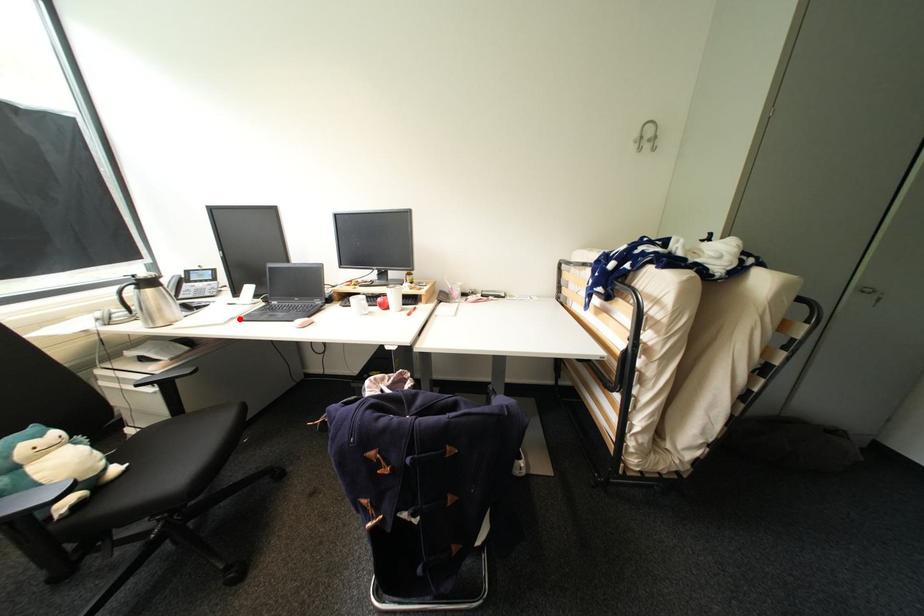
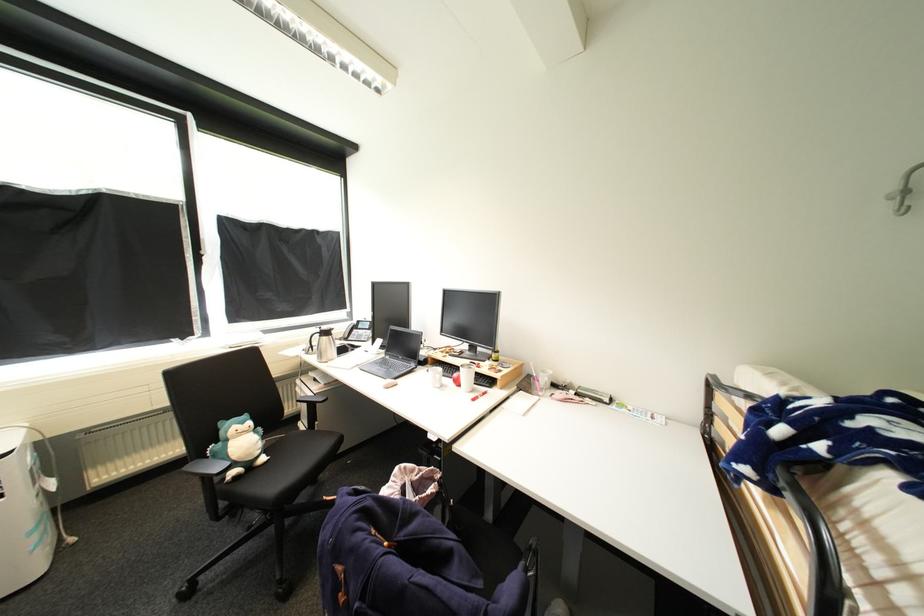
Question: I am providing you with two images of the same scene from different viewpoints. A red point is marked on the first image. At the location where the point appears in image 1, is it still visible in image 2?

Choices:
 (A) Yes
 (B) No

Answer: (A)